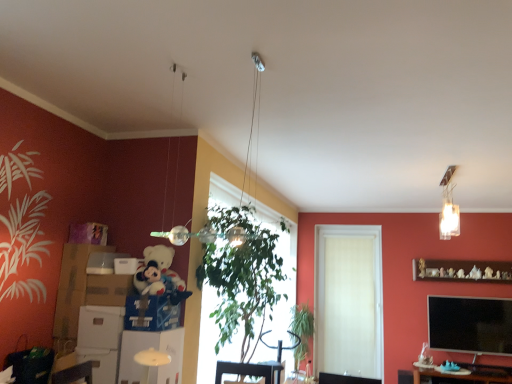
Question: Does white matte door at center appear on the right side of matte cardboard box at left, which appears as the first box when ordered from the bottom?

Choices:
 (A) no
 (B) yes

Answer: (B)

Question: Can you confirm if white matte door at center is thinner than matte cardboard box at left, which appears as the first box when ordered from the bottom?

Choices:
 (A) no
 (B) yes

Answer: (B)

Question: Is white matte door at center taller than matte cardboard box at left, placed as the 2th box when sorted from top to bottom?

Choices:
 (A) no
 (B) yes

Answer: (B)

Question: Does white matte door at center have a lesser height compared to matte cardboard box at left, which appears as the first box when ordered from the bottom?

Choices:
 (A) no
 (B) yes

Answer: (A)

Question: Could you tell me if white matte door at center is facing matte cardboard box at left, which appears as the first box when ordered from the bottom?

Choices:
 (A) no
 (B) yes

Answer: (B)

Question: Is white glossy shelf at lower center, acting as the first shelf starting from the front, situated inside blue cardboard box at lower left, which is the first cardboard box in right-to-left order, or outside?

Choices:
 (A) outside
 (B) inside

Answer: (A)

Question: In terms of width, does white glossy shelf at lower center, which ranks as the second shelf in back-to-front order, look wider or thinner when compared to blue cardboard box at lower left, the 3th cardboard box viewed from the left?

Choices:
 (A) wide
 (B) thin

Answer: (B)

Question: Does point (179, 382) appear closer or farther from the camera than point (133, 319)?

Choices:
 (A) closer
 (B) farther

Answer: (B)

Question: From the image's perspective, relative to blue cardboard box at lower left, which is the first cardboard box in right-to-left order, is white glossy shelf at lower center, which ranks as the second shelf in back-to-front order, above or below?

Choices:
 (A) below
 (B) above

Answer: (A)

Question: Considering the relative positions of green leafy plant at center and clear glass light fixture at upper right in the image provided, is green leafy plant at center to the left or to the right of clear glass light fixture at upper right?

Choices:
 (A) left
 (B) right

Answer: (A)

Question: In terms of height, does green leafy plant at center look taller or shorter compared to clear glass light fixture at upper right?

Choices:
 (A) tall
 (B) short

Answer: (A)

Question: Relative to clear glass light fixture at upper right, is green leafy plant at center in front or behind?

Choices:
 (A) front
 (B) behind

Answer: (B)

Question: Choose the correct answer: Is green leafy plant at center inside clear glass light fixture at upper right or outside it?

Choices:
 (A) outside
 (B) inside

Answer: (A)

Question: In terms of height, does metallic silver swivel chair at center look taller or shorter compared to white cardboard box at lower left, placed as the 3th cardboard box when sorted from right to left?

Choices:
 (A) short
 (B) tall

Answer: (B)

Question: Is metallic silver swivel chair at center inside or outside of white cardboard box at lower left, placed as the 1th cardboard box when sorted from left to right?

Choices:
 (A) inside
 (B) outside

Answer: (B)